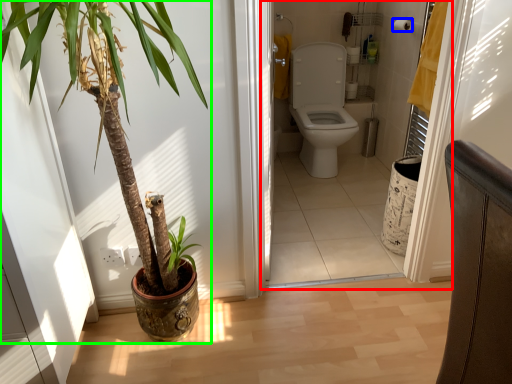
Question: Which is nearer to the corridor (highlighted by a red box)? toilet paper (highlighted by a blue box) or houseplant (highlighted by a green box).

Choices:
 (A) toilet paper
 (B) houseplant

Answer: (A)